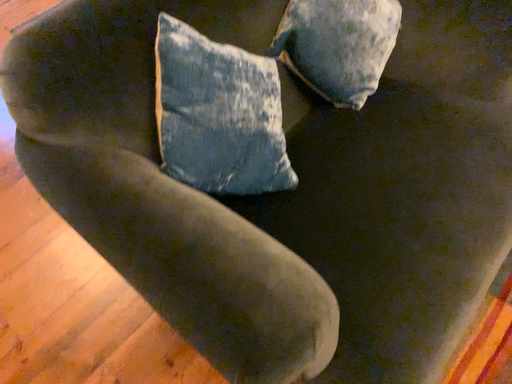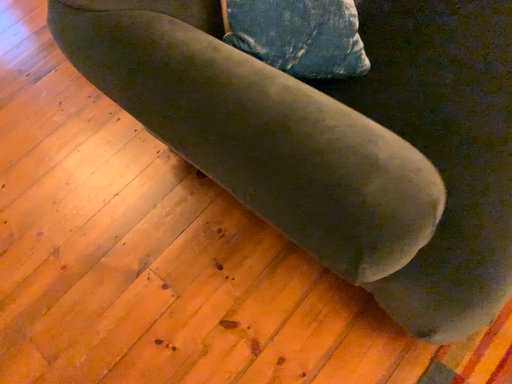
Question: How did the camera likely rotate when shooting the video?

Choices:
 (A) rotated upward
 (B) rotated downward

Answer: (B)